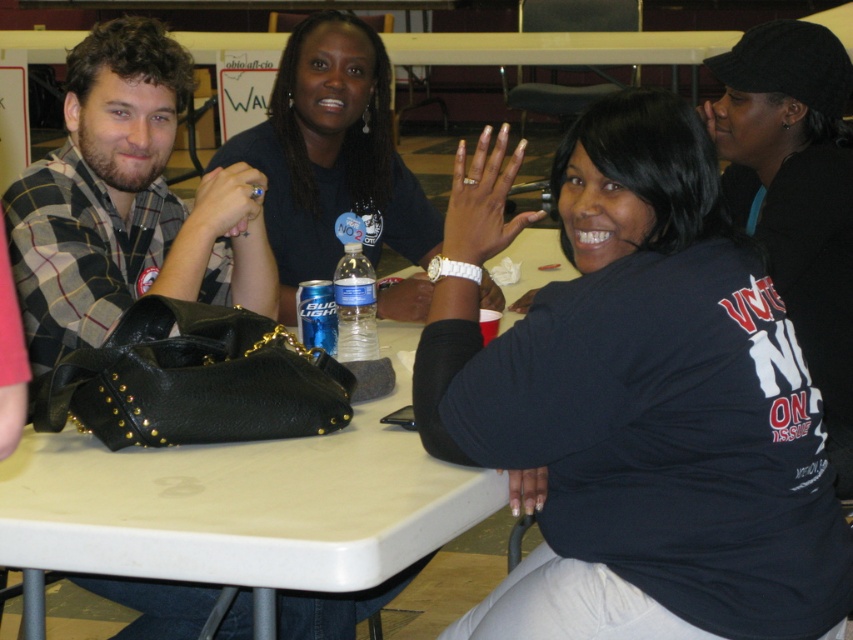
Question: Which of these objects is positioned farthest from the white acrylic nails at lower center?

Choices:
 (A) black fabric shirt at upper right
 (B) blue plastic water bottle at center
 (C) clear plastic cup at center
 (D) white plastic table at center

Answer: (C)

Question: Which point is farther to the camera?

Choices:
 (A) blue plastic water bottle at center
 (B) white plastic table at center

Answer: (A)

Question: Does black fabric shirt at upper right lie behind white acrylic nails at lower center?

Choices:
 (A) yes
 (B) no

Answer: (B)

Question: Does white plastic table at center have a lesser width compared to black matte shirt at upper right?

Choices:
 (A) no
 (B) yes

Answer: (A)

Question: Which object is farther from the camera taking this photo?

Choices:
 (A) white acrylic nails at lower center
 (B) white plastic table at center

Answer: (A)

Question: Does blue plastic water bottle at center appear under clear plastic cup at center?

Choices:
 (A) yes
 (B) no

Answer: (A)